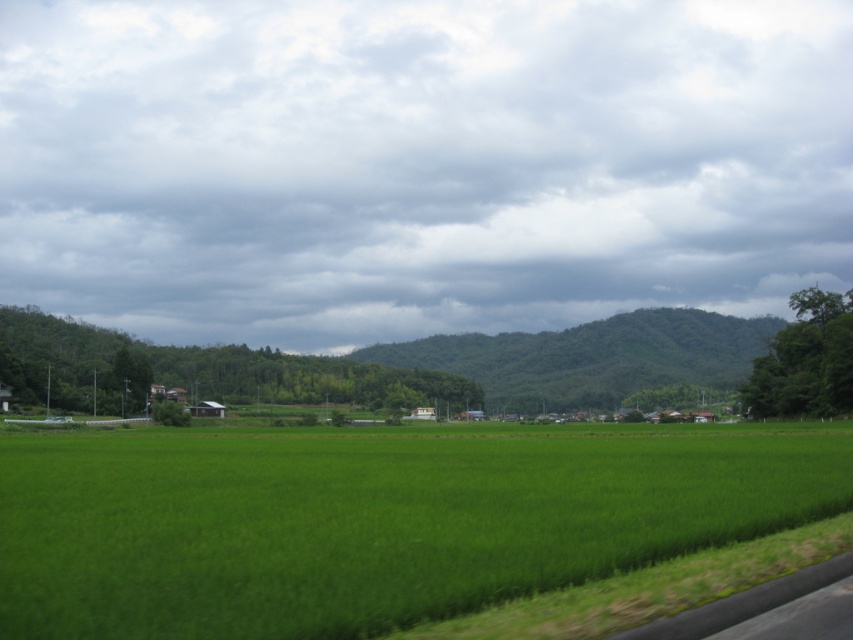
You are standing in the middle of the green leafy mountain at center and want to look up at the cloudy sky at upper center. In which direction should you look?

You should look upward because the cloudy sky at upper center is located above the green leafy mountain at center.

You are standing at the origin point of the image coordinate system. You want to walk to the green grass at center. According to the coordinate system, in which direction should you move? Please specify the direction as either up, down, left, or right.

The green grass at center is located at coordinate point 0.812 on the x axis and 0.440 on the y axis. Since you are at the origin point, which is typically the bottom left corner of the image, you should move right to increase the x value and up to increase the y value. Therefore, to reach the green grass at center, you need to move both right and up from your current position.

You are a photographer standing at the edge of the green grass at center, aiming to capture the entire green leafy mountain at center in your shot. Given that your camera has a fixed focal length, would you need to move closer or farther away to ensure the mountain fits entirely within the frame?

Since the green grass at center is narrower than the green leafy mountain at center, you would need to move farther away to ensure the wider mountain fits entirely within the frame.